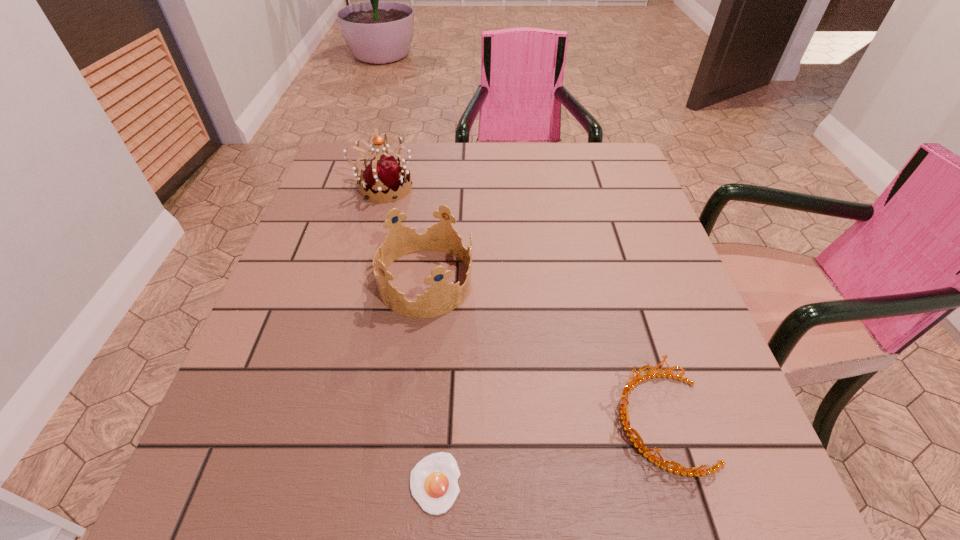
The height and width of the screenshot is (540, 960). Find the location of `vacant space that satisfies the following two spatial constraints: 1. on the front-facing side of the shortest object; 2. on the right side of the tallest tiara`. vacant space that satisfies the following two spatial constraints: 1. on the front-facing side of the shortest object; 2. on the right side of the tallest tiara is located at coordinates (305, 483).

Find the location of `vacant space that satisfies the following two spatial constraints: 1. on the back side of the egg yolk; 2. on the front-facing side of the tallest object`. vacant space that satisfies the following two spatial constraints: 1. on the back side of the egg yolk; 2. on the front-facing side of the tallest object is located at coordinates tap(455, 188).

Locate an element on the screen. The image size is (960, 540). blank area in the image that satisfies the following two spatial constraints: 1. on the front-facing side of the nearest tiara; 2. on the front side of the egg yolk is located at coordinates (680, 483).

Image resolution: width=960 pixels, height=540 pixels. I want to click on free space that satisfies the following two spatial constraints: 1. on the front-facing side of the third shortest object; 2. on the right side of the egg yolk, so click(x=400, y=483).